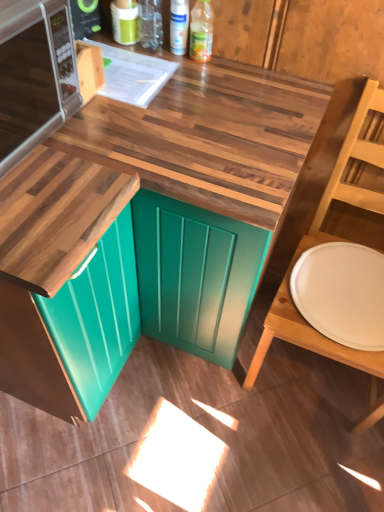
The height and width of the screenshot is (512, 384). I want to click on free space in front of teal glossy cabinet at lower left, so click(x=55, y=456).